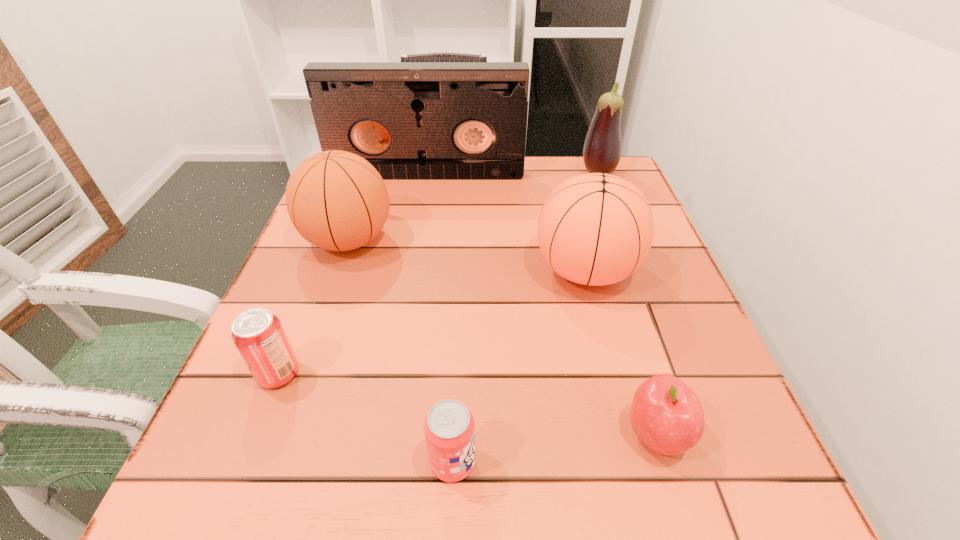
This screenshot has width=960, height=540. Identify the location of empty space that is in between the right basketball and the videotape. (506, 222).

This screenshot has height=540, width=960. Find the location of `object that is the second nearest to the apple`. object that is the second nearest to the apple is located at coordinates (449, 428).

I want to click on object that stands as the second closest to the right basketball, so click(x=602, y=148).

At what (x,y) coordinates should I click in order to perform the action: click on free location that satisfies the following two spatial constraints: 1. on the front side of the right basketball; 2. on the right side of the videotape. Please return your answer as a coordinate pair (x, y). The height and width of the screenshot is (540, 960). Looking at the image, I should click on (411, 271).